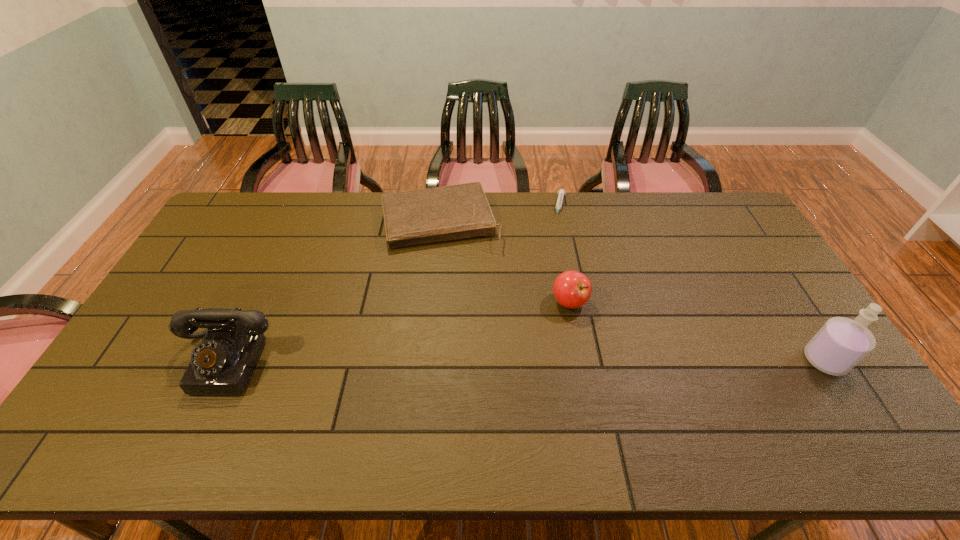
The width and height of the screenshot is (960, 540). What are the coordinates of `telephone` in the screenshot? It's located at (222, 363).

This screenshot has height=540, width=960. In order to click on the second tallest object in this screenshot , I will do `click(222, 363)`.

This screenshot has width=960, height=540. Find the location of `perfume`. perfume is located at coordinates (841, 343).

The image size is (960, 540). In order to click on the rightmost object in this screenshot , I will do (841, 343).

Where is `the third farthest object`? the third farthest object is located at coordinates click(x=572, y=289).

The image size is (960, 540). I want to click on apple, so click(572, 289).

This screenshot has height=540, width=960. I want to click on syringe, so click(561, 192).

Where is `the second shortest object`? the second shortest object is located at coordinates (414, 217).

At what (x,y) coordinates should I click in order to perform the action: click on paperback book. Please return your answer as a coordinate pair (x, y). This screenshot has height=540, width=960. Looking at the image, I should click on (414, 217).

The height and width of the screenshot is (540, 960). What are the coordinates of `free space located on the back of the rightmost object` in the screenshot? It's located at (780, 291).